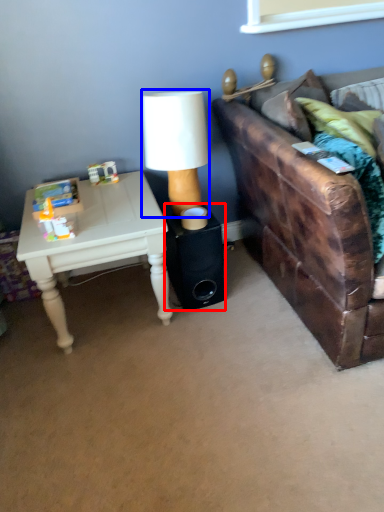
Question: Among these objects, which one is farthest to the camera, speaker (highlighted by a red box) or table lamp (highlighted by a blue box)?

Choices:
 (A) speaker
 (B) table lamp

Answer: (A)